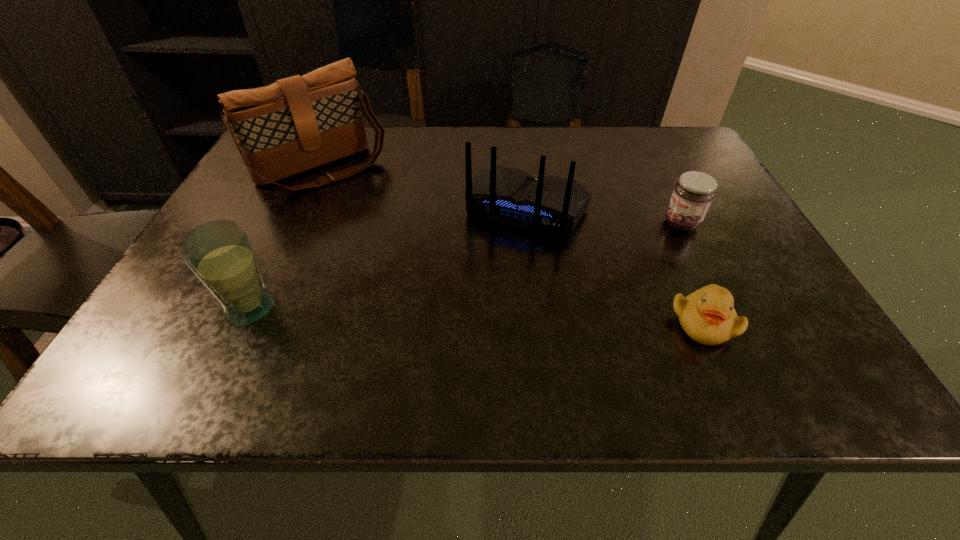
At what (x,y) coordinates should I click in order to perform the action: click on empty space that is in between the jam and the glass. Please return your answer as a coordinate pair (x, y). The width and height of the screenshot is (960, 540). Looking at the image, I should click on (467, 266).

The width and height of the screenshot is (960, 540). I want to click on vacant area that lies between the tallest object and the glass, so [287, 238].

The width and height of the screenshot is (960, 540). Find the location of `empty space between the duckling and the shoulder bag`. empty space between the duckling and the shoulder bag is located at coordinates (513, 246).

At what (x,y) coordinates should I click in order to perform the action: click on free space that is in between the glass and the second shortest object. Please return your answer as a coordinate pair (x, y). The height and width of the screenshot is (540, 960). Looking at the image, I should click on (467, 266).

Where is `unoccupied area between the router and the jam`? unoccupied area between the router and the jam is located at coordinates (605, 215).

Locate an element on the screen. The height and width of the screenshot is (540, 960). vacant region between the second shortest object and the duckling is located at coordinates (692, 273).

I want to click on free space that is in between the router and the tallest object, so click(425, 188).

This screenshot has width=960, height=540. Identify the location of empty location between the glass and the shortest object. (476, 315).

Locate which object ranks fourth in proximity to the shortest object. Please provide its 2D coordinates. Your answer should be formatted as a tuple, i.e. [(x, y)], where the tuple contains the x and y coordinates of a point satisfying the conditions above.

[(220, 253)]

The width and height of the screenshot is (960, 540). What are the coordinates of `object that is the closest to the jam` in the screenshot? It's located at (512, 197).